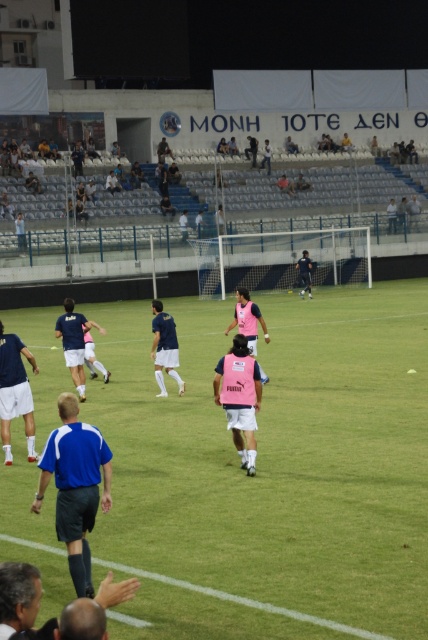
Is the position of blue fabric shirt at center less distant than that of pink fabric vest at center?

Yes, blue fabric shirt at center is in front of pink fabric vest at center.

Is blue fabric shirt at center smaller than pink fabric vest at center?

Incorrect, blue fabric shirt at center is not smaller in size than pink fabric vest at center.

Between point (104, 499) and point (249, 422), which one is positioned behind?

The point (249, 422) is behind.

Image resolution: width=428 pixels, height=640 pixels. Find the location of `blue fabric shirt at center`. blue fabric shirt at center is located at coordinates (76, 484).

Does dark blue jersey at center have a greater width compared to pink fabric shirt at center?

Result: Incorrect, dark blue jersey at center's width does not surpass pink fabric shirt at center's.

Who is taller, dark blue jersey at center or pink fabric shirt at center?

Standing taller between the two is dark blue jersey at center.

Is point (300, 262) more distant than point (267, 145)?

No.

At what (x,y) coordinates should I click in order to perform the action: click on dark blue jersey at center. Please return your answer as a coordinate pair (x, y). Looking at the image, I should click on (305, 273).

Which is in front, point (246, 460) or point (12, 387)?

Point (246, 460) is more forward.

Identify the location of pink fabric vest at center. This screenshot has height=640, width=428. (240, 397).

Is point (240, 397) closer to camera compared to point (9, 397)?

Yes, it is.

At what (x,y) coordinates should I click in order to perform the action: click on pink fabric vest at center. Please return your answer as a coordinate pair (x, y). This screenshot has width=428, height=640. Looking at the image, I should click on (240, 397).